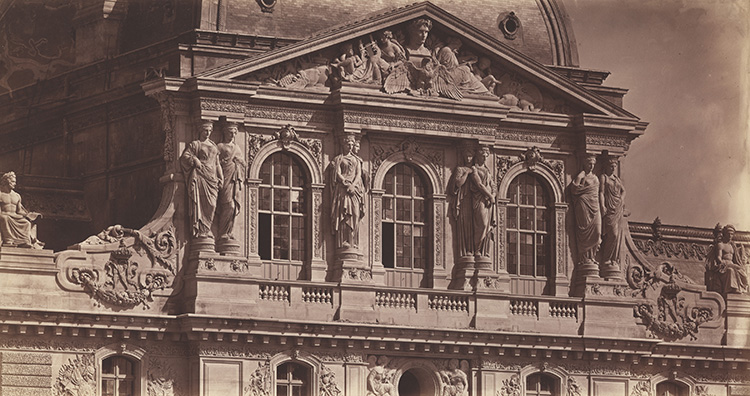
Locate an element on the screen. windows is located at coordinates (540, 216), (410, 210), (282, 200), (300, 373), (112, 382).